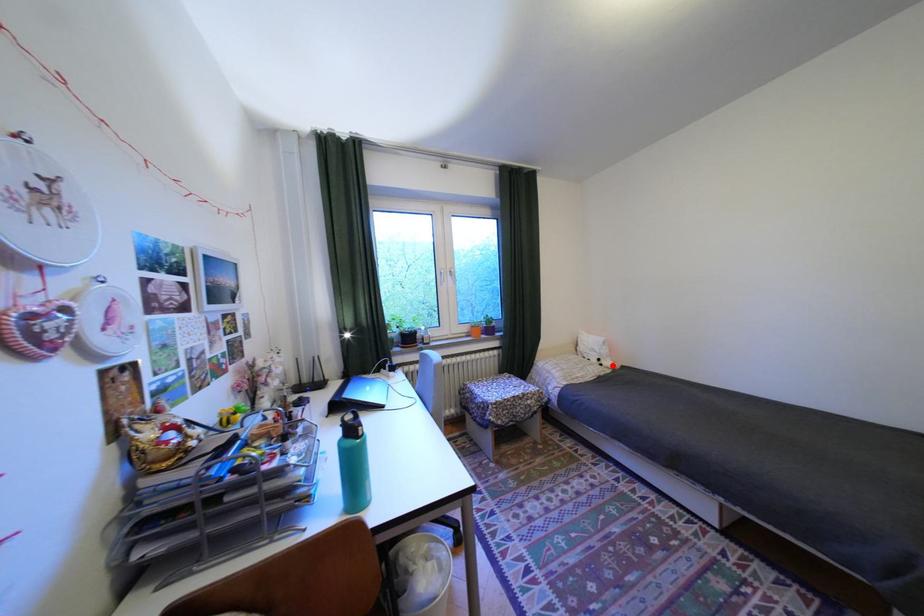
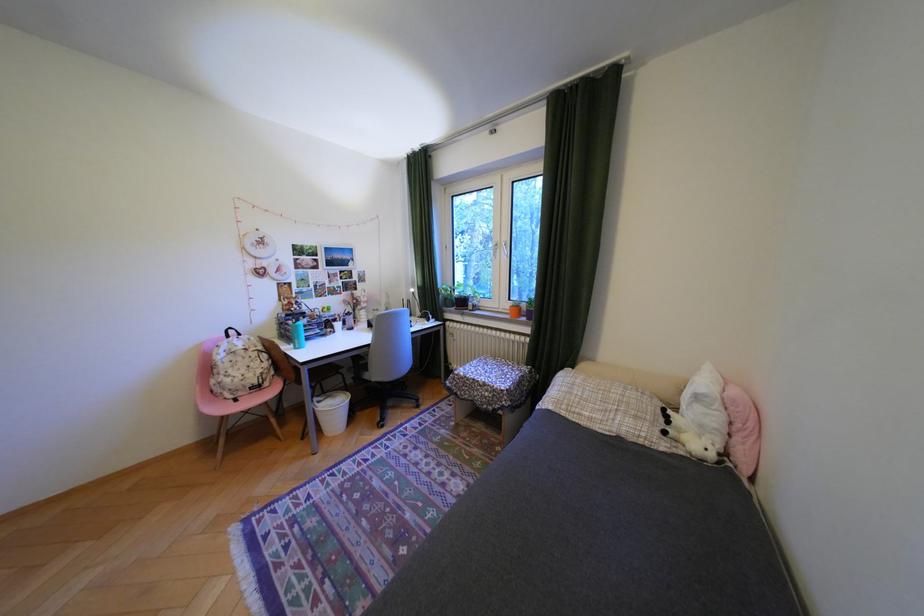
Find the pixel in the second image that matches the highlighted location in the first image.

(676, 432)